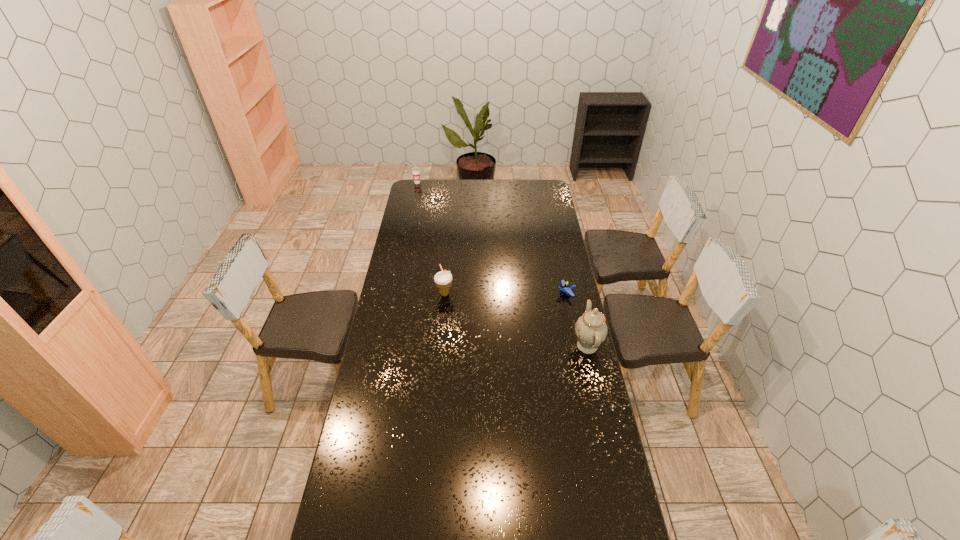
This screenshot has height=540, width=960. In order to click on the third object from right to left in this screenshot , I will do `click(443, 280)`.

The width and height of the screenshot is (960, 540). Identify the location of chinaware. (591, 329).

You are a GUI agent. You are given a task and a screenshot of the screen. Output one action in this format:
    pyautogui.click(x=<x>, y=<y>)
    Task: Click on the tallest object
    The width and height of the screenshot is (960, 540).
    Given the screenshot: What is the action you would take?
    pyautogui.click(x=591, y=329)

Where is `the shortest object`? Image resolution: width=960 pixels, height=540 pixels. the shortest object is located at coordinates (566, 287).

Identify the location of cup. The width and height of the screenshot is (960, 540). (416, 170).

The image size is (960, 540). What are the coordinates of `the leftmost object` in the screenshot? It's located at (416, 170).

The image size is (960, 540). In order to click on free space located on the front of the second object from left to right in this screenshot , I will do `click(443, 316)`.

The height and width of the screenshot is (540, 960). Find the location of `vacant space situated 0.110m on the spout of the nearest object`. vacant space situated 0.110m on the spout of the nearest object is located at coordinates (545, 346).

Locate an element on the screen. This screenshot has width=960, height=540. vacant area located on the spout of the nearest object is located at coordinates (512, 346).

Find the location of `vacant space located 0.110m on the spout of the nearest object`. vacant space located 0.110m on the spout of the nearest object is located at coordinates click(x=545, y=346).